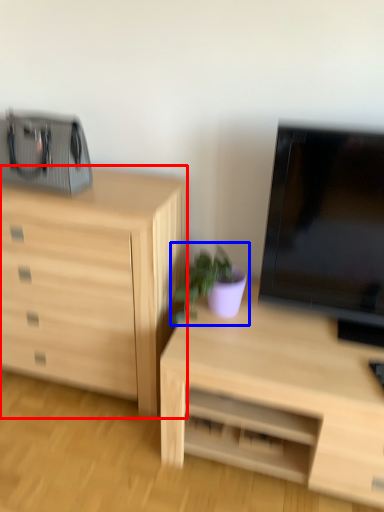
Question: Which of the following is the closest to the observer, chest of drawers (highlighted by a red box) or houseplant (highlighted by a blue box)?

Choices:
 (A) chest of drawers
 (B) houseplant

Answer: (A)